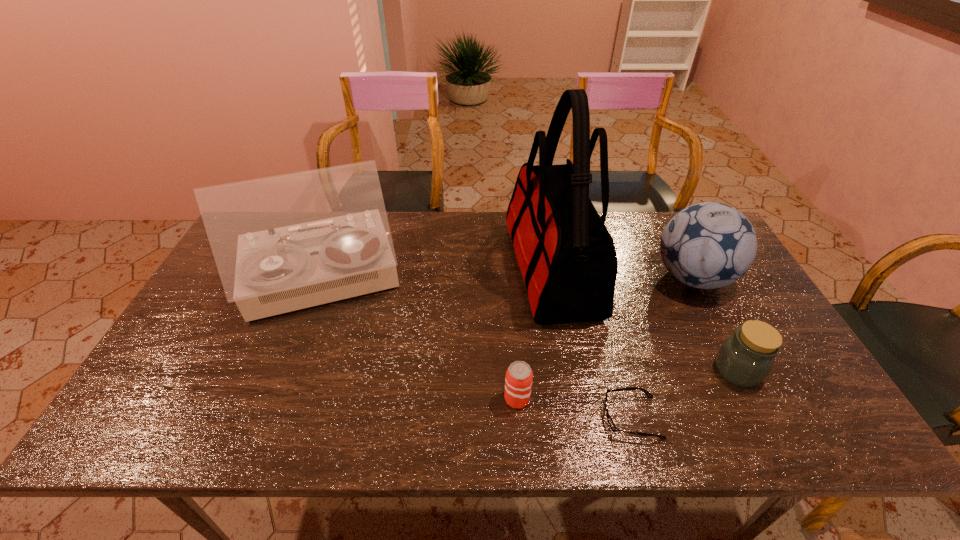
Find the location of `object that stands as the second closest to the fourth shortest object`. object that stands as the second closest to the fourth shortest object is located at coordinates (567, 257).

Where is `the third closest object to the duffel bag`? The height and width of the screenshot is (540, 960). the third closest object to the duffel bag is located at coordinates (609, 419).